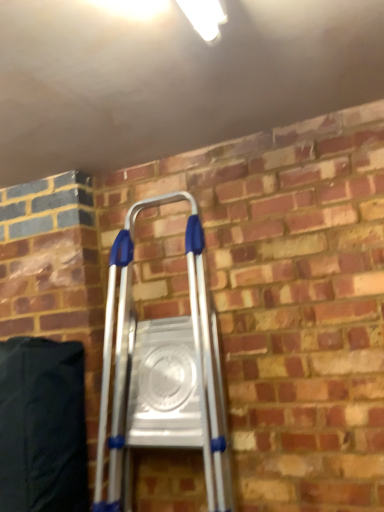
Question: From a real-world perspective, is black fabric bean bag chair at lower left above or below silver metallic ladder at center?

Choices:
 (A) below
 (B) above

Answer: (A)

Question: In the image, is black fabric bean bag chair at lower left positioned in front of or behind silver metallic ladder at center?

Choices:
 (A) front
 (B) behind

Answer: (B)

Question: From the image's perspective, is black fabric bean bag chair at lower left positioned above or below silver metallic ladder at center?

Choices:
 (A) below
 (B) above

Answer: (A)

Question: Is point (198, 425) closer or farther from the camera than point (41, 493)?

Choices:
 (A) closer
 (B) farther

Answer: (B)

Question: Looking at their shapes, would you say silver metallic ladder at center is wider or thinner than black fabric bean bag chair at lower left?

Choices:
 (A) wide
 (B) thin

Answer: (A)

Question: Considering the relative positions of silver metallic ladder at center and black fabric bean bag chair at lower left in the image provided, is silver metallic ladder at center to the left or to the right of black fabric bean bag chair at lower left?

Choices:
 (A) left
 (B) right

Answer: (B)

Question: Is silver metallic ladder at center inside or outside of black fabric bean bag chair at lower left?

Choices:
 (A) inside
 (B) outside

Answer: (B)